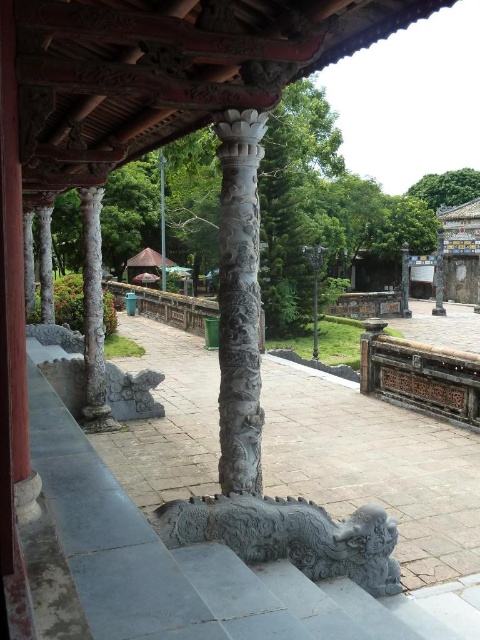
You are standing at the entrance of the historical site and notice two points marked on the ground. The first point is at coordinates point [254,144] and the second is at point [370,563]. If you want to walk towards the point that is closer to the entrance, which coordinate should you head towards?

Point [370,563] is closer to the entrance because it is in front of point [254,144], which is behind it.

You are an architect assessing the structural integrity of the columns in this traditional setting. Given that the white stone column at left and the carved stone pillar at center are critical load bearers, which one might be more prone to buckling under pressure based on their dimensions?

The white stone column at left has a lesser width compared to the carved stone pillar at center, so it might be more prone to buckling under pressure due to its smaller diameter providing less stability.

You are an architect visiting this historical site and need to determine the relative sizes of the columns for a restoration project. Which object is smaller in size between the white stone column at left and the carved stone pillar at center?

The white stone column at left is smaller in size compared to the carved stone pillar at center, so the white stone column at left is the smaller one.